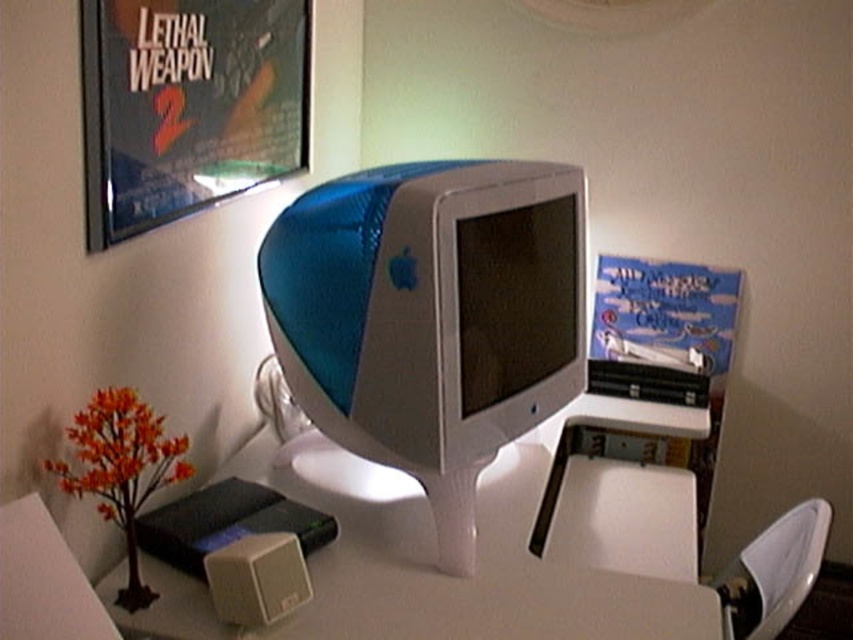
Can you confirm if blue plastic monitor at center is smaller than matte plastic poster at upper left?

No, blue plastic monitor at center is not smaller than matte plastic poster at upper left.

Does blue plastic monitor at center have a greater height compared to matte plastic poster at upper left?

Yes, blue plastic monitor at center is taller than matte plastic poster at upper left.

Who is more forward, (367, 346) or (302, 61)?

Point (367, 346) is in front.

At what (x,y) coordinates should I click in order to perform the action: click on blue plastic monitor at center. Please return your answer as a coordinate pair (x, y). The image size is (853, 640). Looking at the image, I should click on (431, 316).

Can you confirm if white glossy table at center is taller than matte plastic poster at upper left?

Incorrect, white glossy table at center's height is not larger of matte plastic poster at upper left's.

Who is taller, white glossy table at center or matte plastic poster at upper left?

Standing taller between the two is matte plastic poster at upper left.

Where is `white glossy table at center`? This screenshot has width=853, height=640. white glossy table at center is located at coordinates (477, 556).

Locate an element on the screen. The height and width of the screenshot is (640, 853). white glossy table at center is located at coordinates (477, 556).

Is point (370, 182) more distant than point (672, 532)?

No, (370, 182) is closer to viewer.

Is blue plastic monitor at center wider than white glossy table at center?

Incorrect, blue plastic monitor at center's width does not surpass white glossy table at center's.

The height and width of the screenshot is (640, 853). Describe the element at coordinates (431, 316) in the screenshot. I see `blue plastic monitor at center` at that location.

The image size is (853, 640). Identify the location of blue plastic monitor at center. (431, 316).